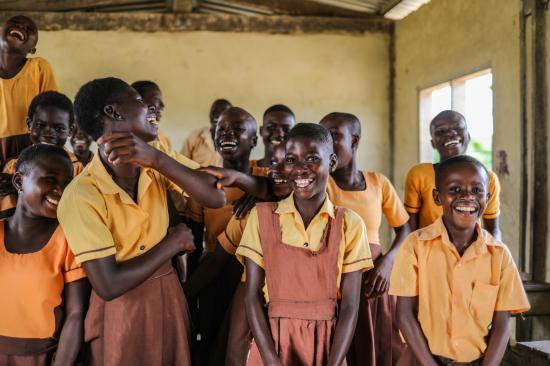
Identify the location of table. (527, 345).